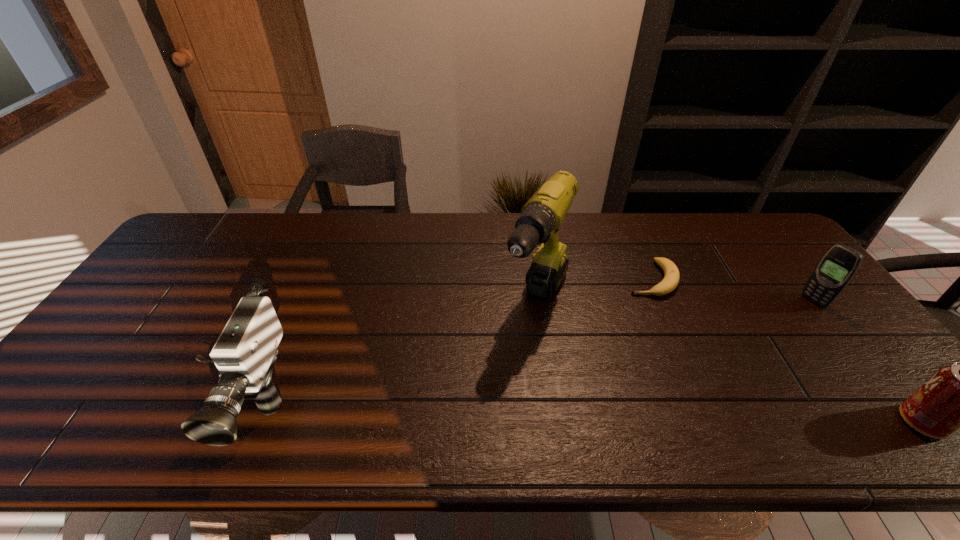
Find the location of a particular element. Image resolution: width=960 pixels, height=540 pixels. the second tallest object is located at coordinates (x=245, y=353).

Where is `the leftmost object`? the leftmost object is located at coordinates (245, 353).

What are the coordinates of `soda can` in the screenshot? It's located at click(x=959, y=396).

Find the location of a particular element. The image size is (960, 540). banana is located at coordinates point(671,273).

At what (x,y) coordinates should I click in order to perform the action: click on the shortest object. Please return your answer as a coordinate pair (x, y). The image size is (960, 540). Looking at the image, I should click on (671, 273).

Image resolution: width=960 pixels, height=540 pixels. Find the location of `the tallest object`. the tallest object is located at coordinates (540, 219).

Image resolution: width=960 pixels, height=540 pixels. Identify the location of the fourth object from right to left. (540, 219).

Where is `cellular telephone`? Image resolution: width=960 pixels, height=540 pixels. cellular telephone is located at coordinates (837, 267).

The height and width of the screenshot is (540, 960). Identify the location of free space located on the back of the soda can. (862, 349).

Identify the location of vacant space located 0.130m at the stem of the shortest object. pos(629,325).